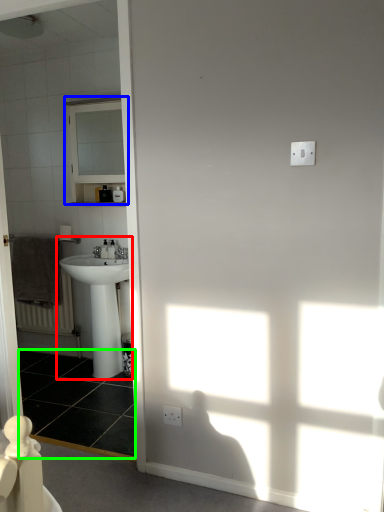
Question: Which object is the closest to the sink (highlighted by a red box)? Choose among these: medicine cabinet (highlighted by a blue box) or tile (highlighted by a green box).

Choices:
 (A) medicine cabinet
 (B) tile

Answer: (B)